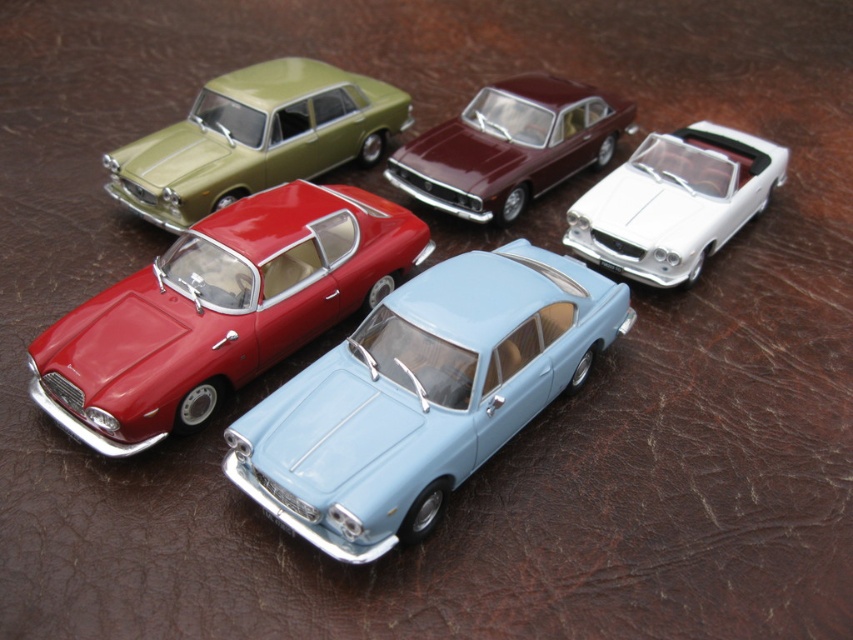
You are standing at the center of the scene and want to place a small sticker exactly at point (422, 396). Which car should you target for placing the sticker?

The point (422, 396) is located on the light blue metallic car at center, so you should place the sticker there.